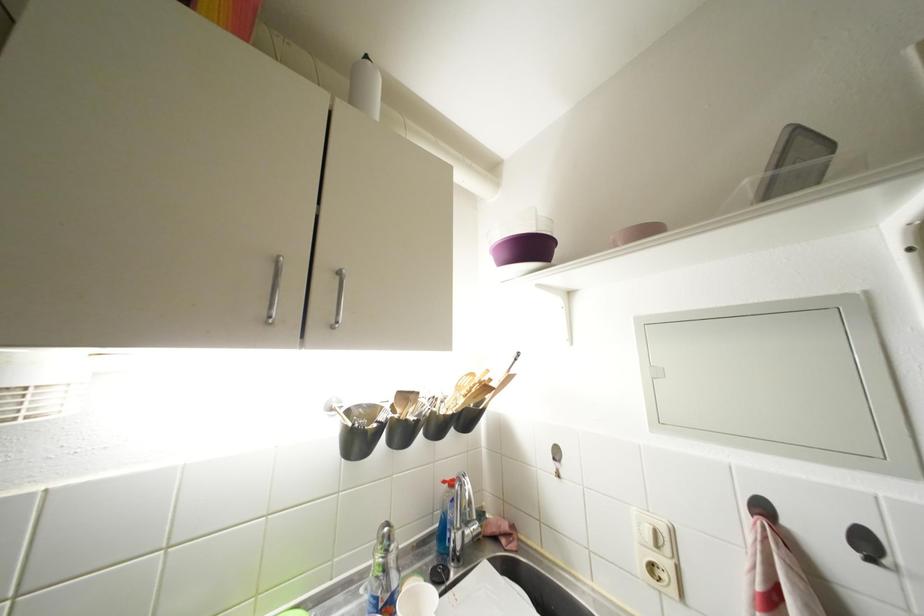
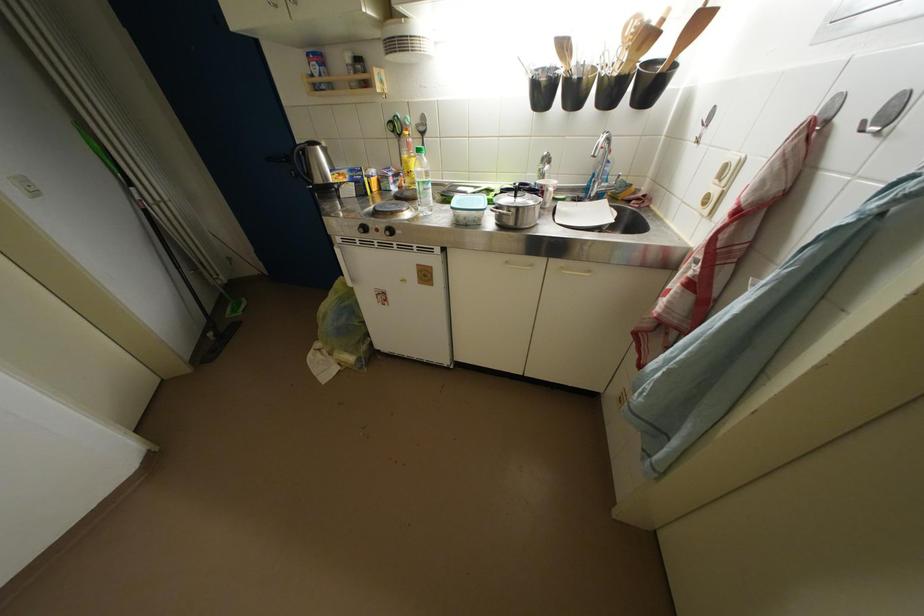
Locate, in the second image, the point that corresponds to (877,565) in the first image.

(869, 132)